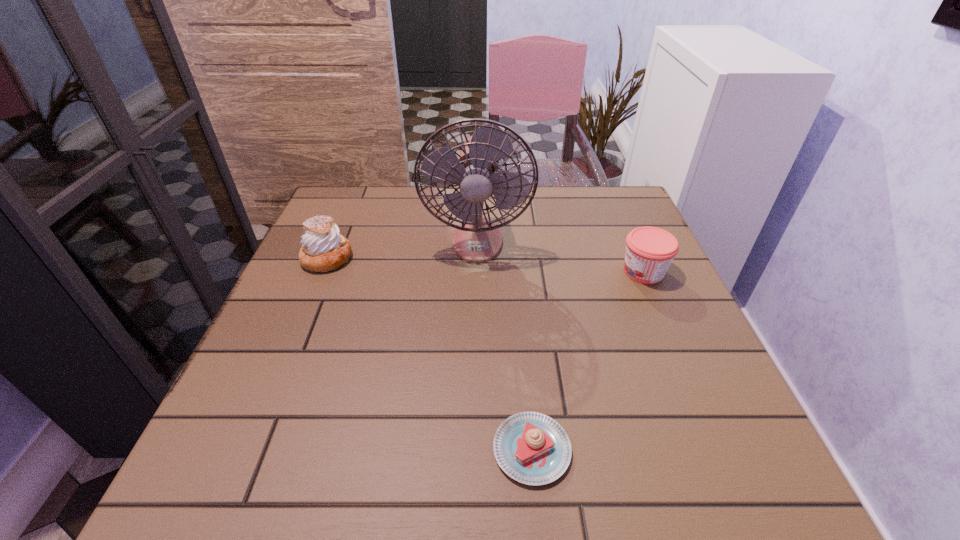
I want to click on free spot between the right pastry and the jam, so click(x=588, y=361).

The image size is (960, 540). Find the location of `vacant space in between the left pastry and the shorter pastry`. vacant space in between the left pastry and the shorter pastry is located at coordinates (429, 354).

What are the coordinates of `free space between the rightmost object and the shorter pastry` in the screenshot? It's located at (588, 361).

This screenshot has width=960, height=540. I want to click on free space between the second shortest object and the farther pastry, so click(486, 265).

Locate which object ranks third in proximity to the second shortest object. Please provide its 2D coordinates. Your answer should be formatted as a tuple, i.e. [(x, y)], where the tuple contains the x and y coordinates of a point satisfying the conditions above.

[(324, 249)]

The height and width of the screenshot is (540, 960). I want to click on object that can be found as the second closest to the nearest object, so click(477, 239).

Image resolution: width=960 pixels, height=540 pixels. In order to click on free spot that satisfies the following two spatial constraints: 1. in front of the fan to direct airflow; 2. on the right side of the right pastry in this screenshot , I will do pos(475,449).

In order to click on free space that satisfies the following two spatial constraints: 1. in front of the nearest object to direct airflow; 2. on the left side of the tallest object in this screenshot , I will do `click(475, 449)`.

Locate an element on the screen. vacant area that satisfies the following two spatial constraints: 1. on the front side of the leftmost object; 2. on the left side of the shorter pastry is located at coordinates (248, 449).

This screenshot has width=960, height=540. Find the location of `free space that satisfies the following two spatial constraints: 1. in front of the right pastry to direct airflow; 2. on the left side of the tallest object`. free space that satisfies the following two spatial constraints: 1. in front of the right pastry to direct airflow; 2. on the left side of the tallest object is located at coordinates (475, 449).